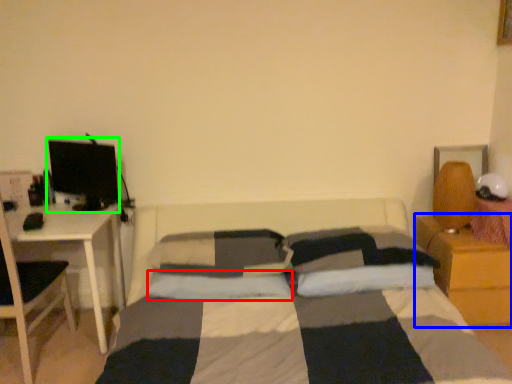
Question: Estimate the real-world distances between objects in this image. Which object is farther from pillow (highlighted by a red box), nightstand (highlighted by a blue box) or computer monitor (highlighted by a green box)?

Choices:
 (A) nightstand
 (B) computer monitor

Answer: (A)